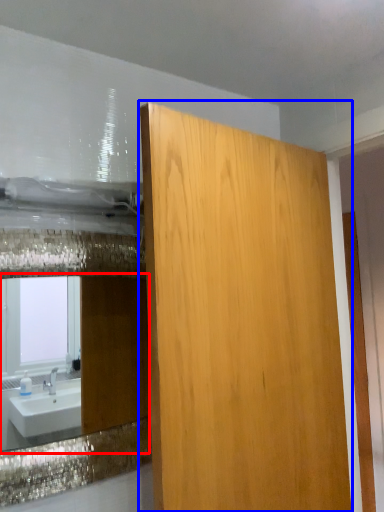
Question: Which of the following is the farthest to the observer, mirror (highlighted by a red box) or bathroom cabinet (highlighted by a blue box)?

Choices:
 (A) mirror
 (B) bathroom cabinet

Answer: (A)